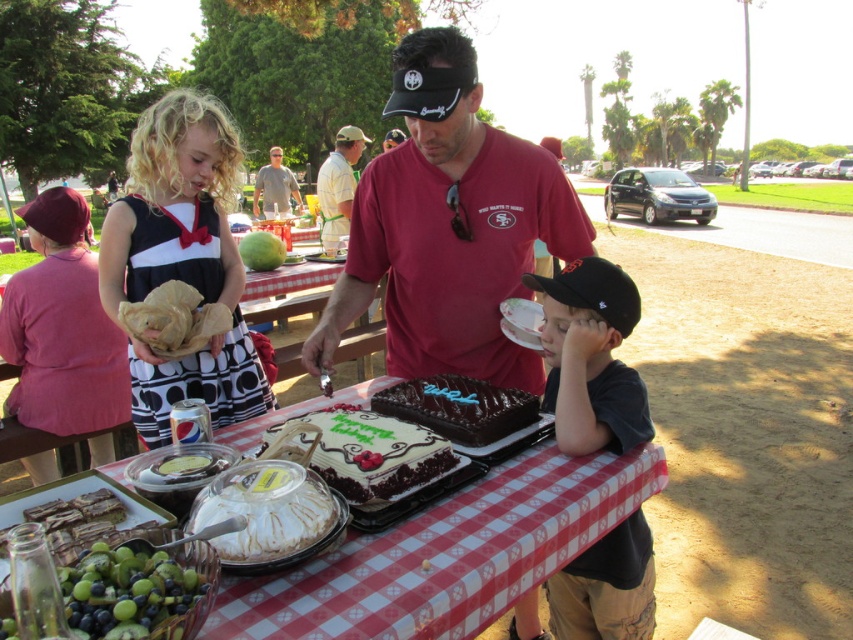
Question: Which of the following is the farthest from the observer?

Choices:
 (A) (451, 28)
 (B) (506, 362)
 (C) (582, 426)

Answer: (B)

Question: Can you confirm if black cotton shirt at lower right is wider than chocolate frosted cake at center?

Choices:
 (A) yes
 (B) no

Answer: (B)

Question: Among these points, which one is farthest from the camera?

Choices:
 (A) (608, 545)
 (B) (184, 634)
 (C) (525, 380)

Answer: (C)

Question: Is chocolate frosted cake at center positioned before chocolatesmoothcake at center?

Choices:
 (A) no
 (B) yes

Answer: (B)

Question: Which of the following is the farthest from the observer?

Choices:
 (A) green matte grapes at lower left
 (B) white checkered tablecloth at center
 (C) black cotton shirt at lower right

Answer: (C)

Question: Can you confirm if white checkered tablecloth at center is thinner than matte black dress at left?

Choices:
 (A) no
 (B) yes

Answer: (A)